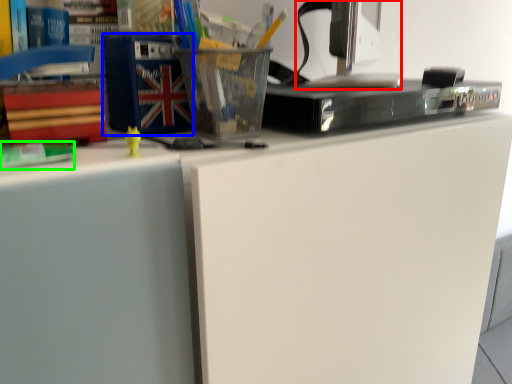
Question: Considering the real-world distances, which object is closest to desktop computer (highlighted by a red box)? paperback book (highlighted by a blue box) or book (highlighted by a green box).

Choices:
 (A) paperback book
 (B) book

Answer: (A)